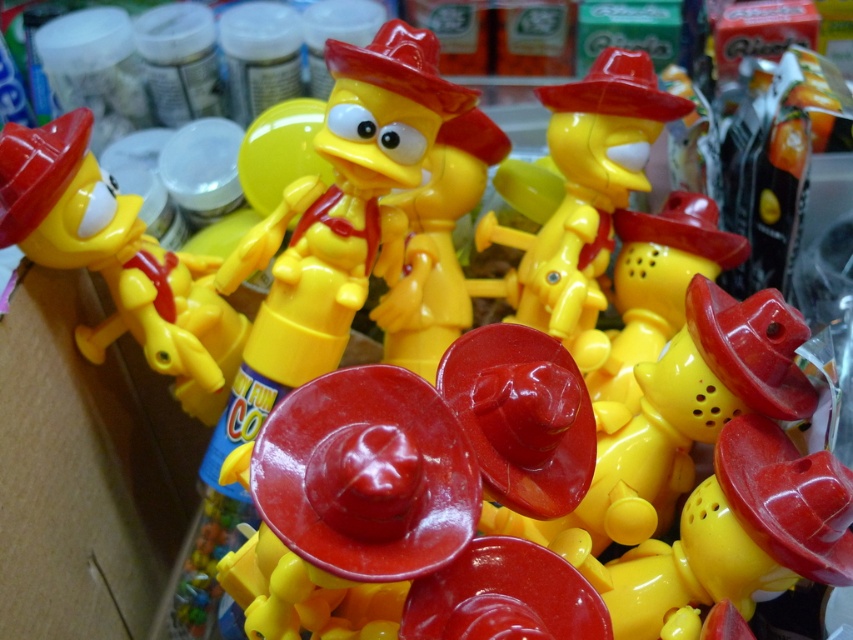
Question: Which object is farther from the camera taking this photo?

Choices:
 (A) matte plastic toy at center
 (B) matte yellow toy at center

Answer: (A)

Question: From the image, what is the correct spatial relationship of matte yellow toy at center in relation to matte plastic toy at center?

Choices:
 (A) above
 (B) below

Answer: (B)

Question: Is matte yellow toy at center further to the viewer compared to matte plastic toy at center?

Choices:
 (A) yes
 (B) no

Answer: (B)

Question: Does matte yellow toy at center have a smaller size compared to matte plastic toy at center?

Choices:
 (A) yes
 (B) no

Answer: (A)

Question: Which point appears closest to the camera in this image?

Choices:
 (A) (550, 298)
 (B) (108, 220)

Answer: (B)

Question: Which point appears farthest from the camera in this image?

Choices:
 (A) (659, 120)
 (B) (144, 243)

Answer: (A)